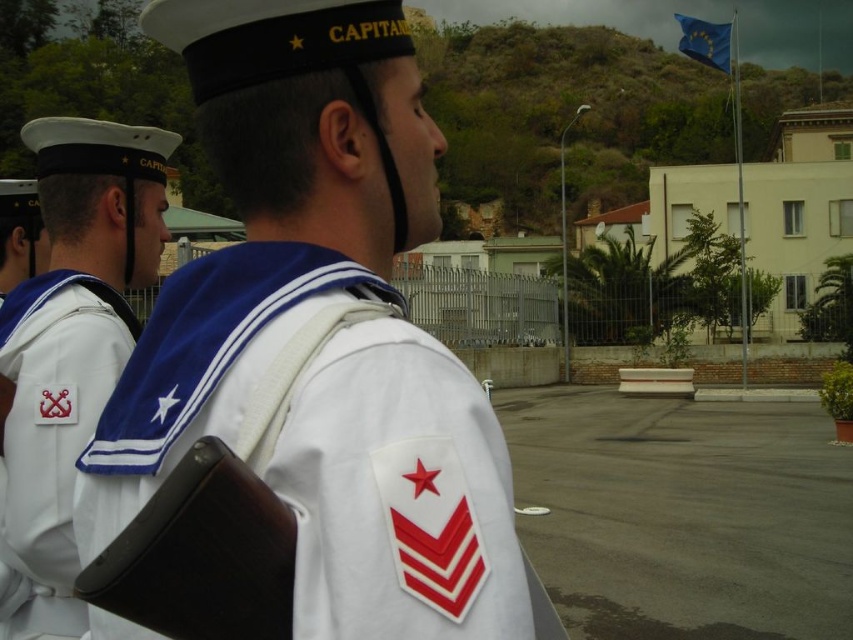
You are a military inspector checking the uniforms in the naval base courtyard. You notice the white matte uniform at center and the white fabric patch at left. Which object is taller?

The white matte uniform at center is much taller than the white fabric patch at left.

You are a photographer trying to capture a photo of the two naval officers in the courtyard. You want to ensure that the white fabric patch at left is visible in the frame. Based on its coordinates, where should you position the camera to include it?

The white fabric patch at left is located at coordinates point (51, 435). To include it in the frame, position the camera so that the view includes this coordinate point.

You are a photographer standing in the courtyard of a naval base. You need to take a photo of the white matte uniform at center and the white fabric patch at left. The camera you are using has a minimum focus distance of 1.5 meters. Can you capture both subjects clearly in the same frame without moving either object?

The white matte uniform at center is 1.76 meters from the white fabric patch at left. Since the distance between them is greater than the camera minimum focus distance of 1.5 meters, you can capture both subjects clearly in the same frame without moving either object.